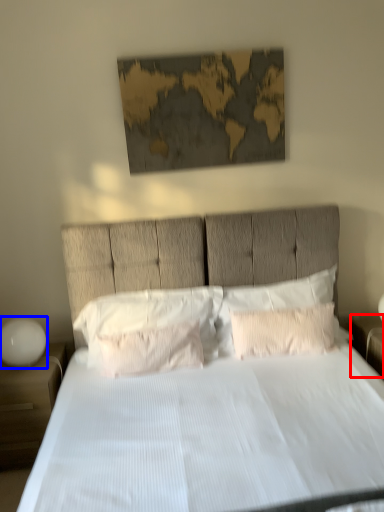
Question: Among these objects, which one is farthest to the camera, nightstand (highlighted by a red box) or bedside lamp (highlighted by a blue box)?

Choices:
 (A) nightstand
 (B) bedside lamp

Answer: (A)